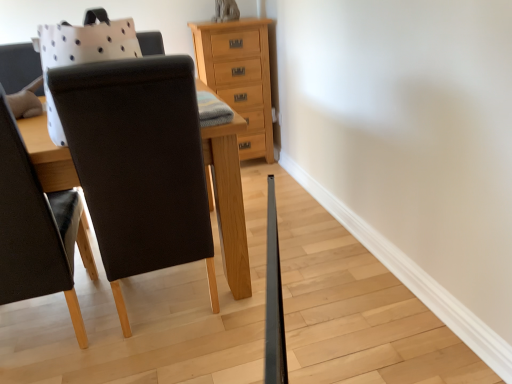
Question: Does natural wood chest of drawers at upper center appear on the left side of matte black chair at left?

Choices:
 (A) no
 (B) yes

Answer: (A)

Question: Does natural wood chest of drawers at upper center have a greater width compared to matte black chair at left?

Choices:
 (A) yes
 (B) no

Answer: (B)

Question: Considering the relative sizes of natural wood chest of drawers at upper center and matte black chair at left in the image provided, is natural wood chest of drawers at upper center shorter than matte black chair at left?

Choices:
 (A) yes
 (B) no

Answer: (A)

Question: Does natural wood chest of drawers at upper center have a lesser width compared to matte black chair at left?

Choices:
 (A) no
 (B) yes

Answer: (B)

Question: Is natural wood chest of drawers at upper center positioned with its back to matte black chair at left?

Choices:
 (A) yes
 (B) no

Answer: (B)

Question: Is natural wood chest of drawers at upper center smaller than matte black chair at left?

Choices:
 (A) yes
 (B) no

Answer: (A)

Question: From the image's perspective, is matte black chair at left under natural wood chest of drawers at upper center?

Choices:
 (A) yes
 (B) no

Answer: (A)

Question: Can you confirm if matte black chair at left is positioned to the left of natural wood chest of drawers at upper center?

Choices:
 (A) yes
 (B) no

Answer: (A)

Question: Is matte black chair at left outside natural wood chest of drawers at upper center?

Choices:
 (A) no
 (B) yes

Answer: (B)

Question: Would you say matte black chair at left contains natural wood chest of drawers at upper center?

Choices:
 (A) yes
 (B) no

Answer: (B)

Question: Does matte black chair at left turn towards natural wood chest of drawers at upper center?

Choices:
 (A) yes
 (B) no

Answer: (B)

Question: Is matte black chair at left taller than natural wood chest of drawers at upper center?

Choices:
 (A) no
 (B) yes

Answer: (B)

Question: Does matte black chair at left have a greater width compared to wooden table at center?

Choices:
 (A) yes
 (B) no

Answer: (B)